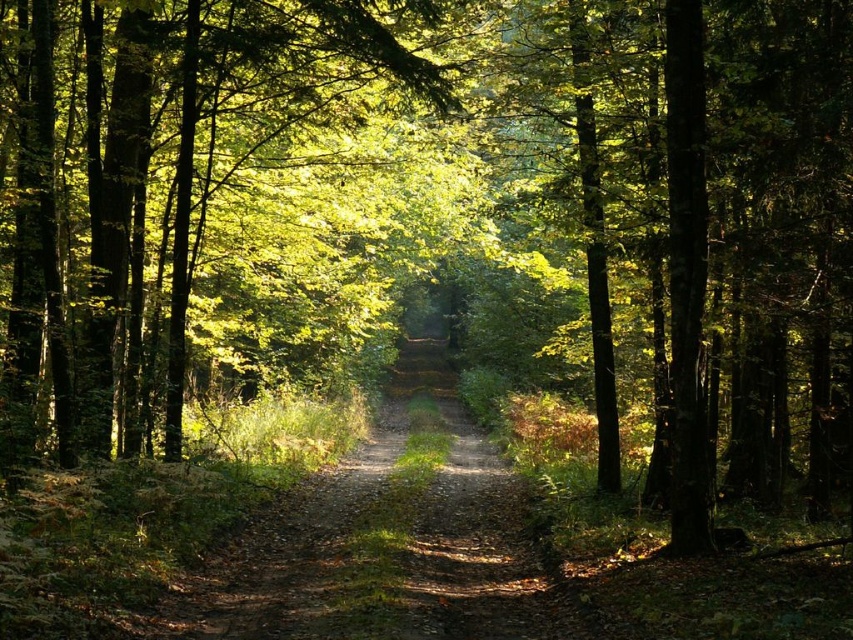
Question: Which of the following is the farthest from the observer?

Choices:
 (A) dirt path at center
 (B) green leafy tree at center

Answer: (B)

Question: In this image, where is green leafy tree at center located relative to dirt path at center?

Choices:
 (A) below
 (B) above

Answer: (B)

Question: Can you confirm if green leafy tree at center is smaller than dirt path at center?

Choices:
 (A) no
 (B) yes

Answer: (A)

Question: Which point is farther from the camera taking this photo?

Choices:
 (A) (440, 627)
 (B) (86, 179)

Answer: (B)

Question: In this image, where is green leafy tree at center located relative to dirt path at center?

Choices:
 (A) left
 (B) right

Answer: (A)